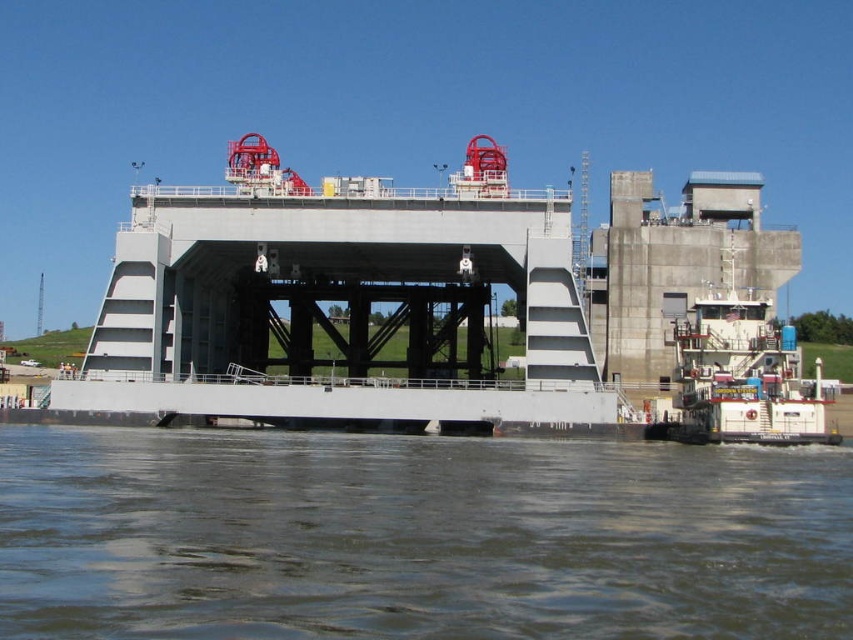
Question: Estimate the real-world distances between objects in this image. Which object is farther from the brown murky water at lower center?

Choices:
 (A) gray metallic bridge at center
 (B) white matte tugboat at lower right

Answer: (A)

Question: Which point is farther from the camera taking this photo?

Choices:
 (A) (718, 371)
 (B) (86, 509)

Answer: (A)

Question: Considering the relative positions of brown murky water at lower center and gray metallic bridge at center in the image provided, where is brown murky water at lower center located with respect to gray metallic bridge at center?

Choices:
 (A) below
 (B) above

Answer: (A)

Question: Can you confirm if brown murky water at lower center is positioned above white matte tugboat at lower right?

Choices:
 (A) no
 (B) yes

Answer: (A)

Question: Which of the following is the closest to the observer?

Choices:
 (A) (740, 390)
 (B) (474, 499)

Answer: (B)

Question: Is gray metallic bridge at center positioned before white matte tugboat at lower right?

Choices:
 (A) no
 (B) yes

Answer: (A)